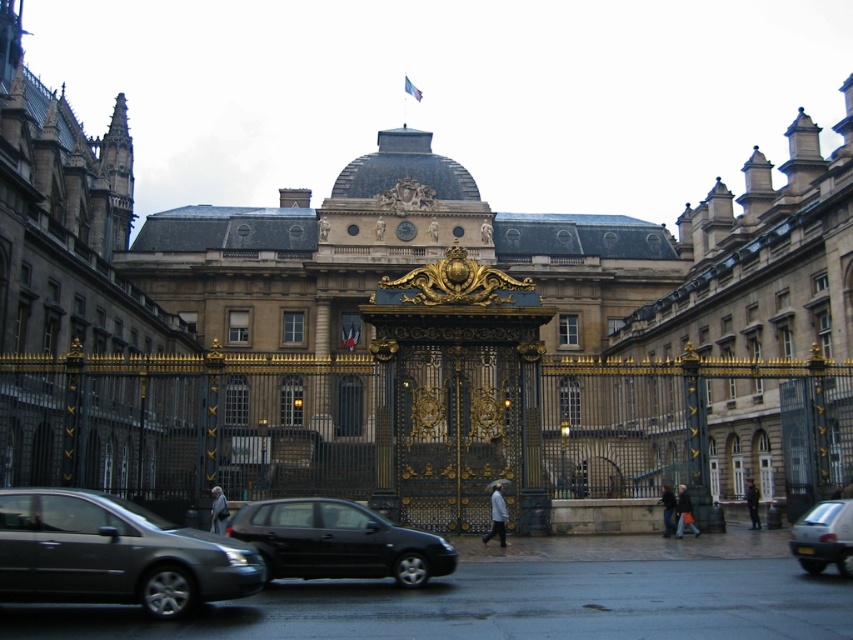
Between point (119, 556) and point (230, 536), which one is positioned in front?

Positioned in front is point (119, 556).

Who is lower down, metallic gray sedan at lower left or black metallic car at lower center?

black metallic car at lower center is below.

Identify the location of metallic gray sedan at lower left. (114, 554).

This screenshot has height=640, width=853. In order to click on metallic gray sedan at lower left in this screenshot , I will do `click(114, 554)`.

Identify the location of metallic gray sedan at lower left. (114, 554).

Can you confirm if metallic gray sedan at lower left is shorter than white glossy car at lower right?

In fact, metallic gray sedan at lower left may be taller than white glossy car at lower right.

This screenshot has height=640, width=853. In order to click on metallic gray sedan at lower left in this screenshot , I will do `click(114, 554)`.

Image resolution: width=853 pixels, height=640 pixels. Find the location of `metallic gray sedan at lower left`. metallic gray sedan at lower left is located at coordinates (114, 554).

Can you confirm if black metallic car at lower center is bigger than white glossy car at lower right?

Yes.

Between point (341, 570) and point (851, 524), which one is positioned in front?

Point (341, 570)

This screenshot has width=853, height=640. Find the location of `black metallic car at lower center`. black metallic car at lower center is located at coordinates (338, 541).

Locate an element on the screen. Image resolution: width=853 pixels, height=640 pixels. black metallic car at lower center is located at coordinates (338, 541).